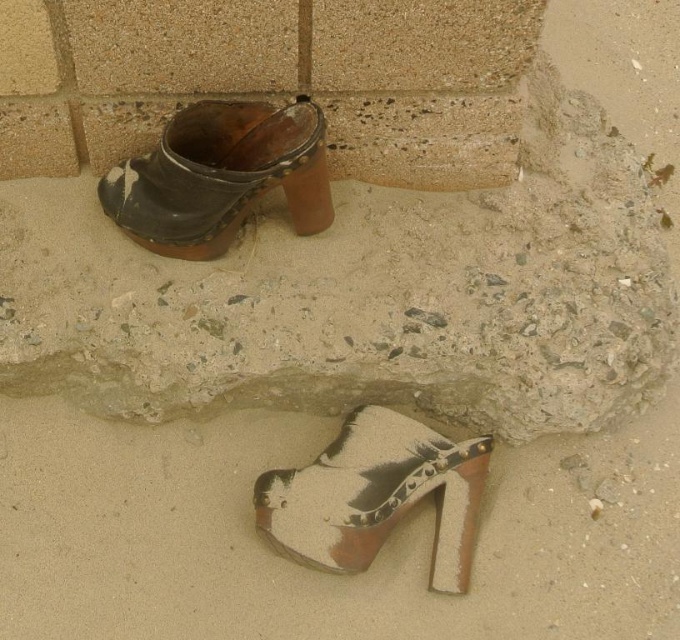
You are standing in front of two high heeled shoes against a concrete wall. You notice two points labeled as point 1 and point 2. Point 1 is at coordinates point (464, 448) and point 2 is at point (292, 205). Which point is closer to you?

Point 1 is closer to the viewer because the description states that point (464, 448) is closer than point (292, 205).